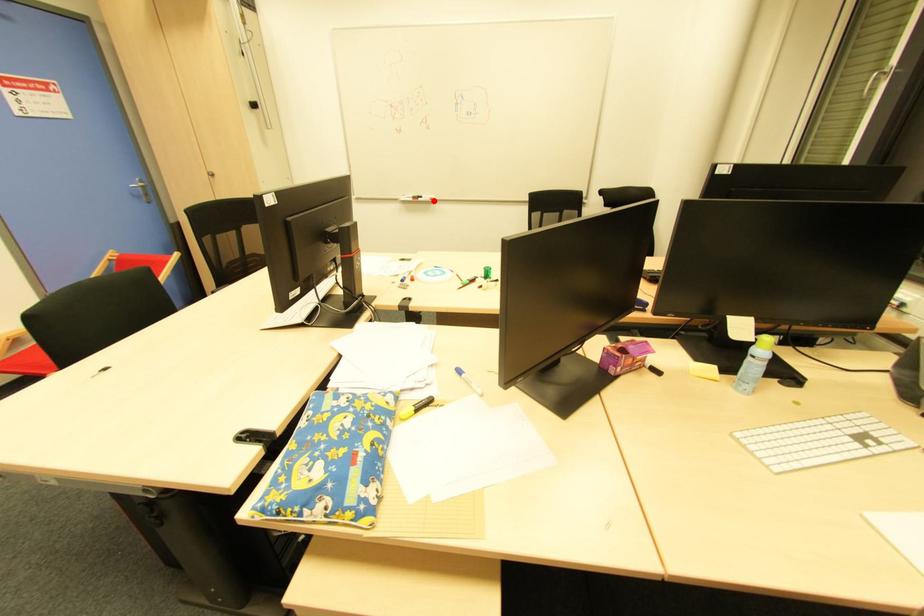
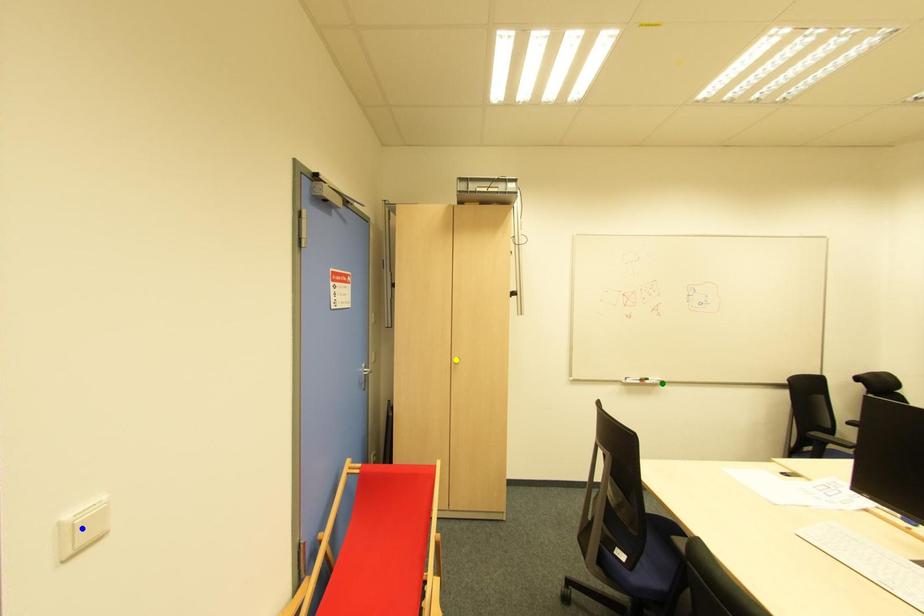
Question: I am providing you with two images of the same scene from different viewpoints. A red point is marked on the first image. You are given multiple points on the second image. In image 2, which mark is for the same physical point as the one in image 1?

Choices:
 (A) green point
 (B) yellow point
 (C) blue point

Answer: (A)